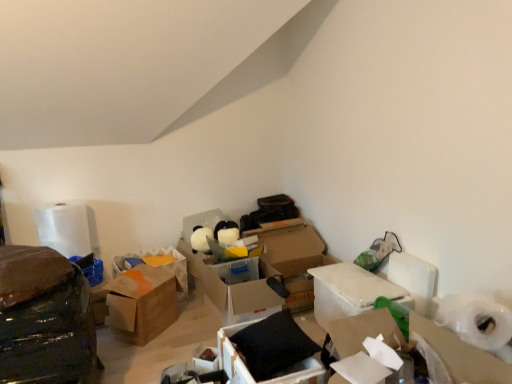
Question: From the image's perspective, is black matte pillow at center, which is the 2th box in right-to-left order, located beneath brown cardboard box at center, the second box from the left?

Choices:
 (A) no
 (B) yes

Answer: (B)

Question: Can you confirm if black matte pillow at center, the 4th box in the left-to-right sequence, is positioned to the left of brown cardboard box at center, placed as the 4th box when sorted from right to left?

Choices:
 (A) yes
 (B) no

Answer: (B)

Question: Considering the relative positions of black matte pillow at center, which is the 2th box in right-to-left order, and brown cardboard box at center, placed as the 4th box when sorted from right to left, in the image provided, is black matte pillow at center, which is the 2th box in right-to-left order, to the right of brown cardboard box at center, placed as the 4th box when sorted from right to left, from the viewer's perspective?

Choices:
 (A) yes
 (B) no

Answer: (A)

Question: Is black matte pillow at center, the 4th box in the left-to-right sequence, bigger than brown cardboard box at center, the second box from the left?

Choices:
 (A) no
 (B) yes

Answer: (A)

Question: From a real-world perspective, is black matte pillow at center, the 4th box in the left-to-right sequence, on top of brown cardboard box at center, placed as the 4th box when sorted from right to left?

Choices:
 (A) yes
 (B) no

Answer: (B)

Question: Considering the positions of matte cardboard box at center and brown cardboard box at center, the second box from the left, in the image, is matte cardboard box at center wider or thinner than brown cardboard box at center, the second box from the left,?

Choices:
 (A) wide
 (B) thin

Answer: (B)

Question: Based on their sizes in the image, would you say matte cardboard box at center is bigger or smaller than brown cardboard box at center, placed as the 4th box when sorted from right to left?

Choices:
 (A) small
 (B) big

Answer: (A)

Question: Considering the positions of matte cardboard box at center and brown cardboard box at center, placed as the 4th box when sorted from right to left, in the image, is matte cardboard box at center taller or shorter than brown cardboard box at center, placed as the 4th box when sorted from right to left,?

Choices:
 (A) tall
 (B) short

Answer: (B)

Question: From a real-world perspective, is matte cardboard box at center physically located above or below brown cardboard box at center, the second box from the left?

Choices:
 (A) below
 (B) above

Answer: (A)

Question: Considering the positions of white cardboard box at center-right, which appears as the fifth box when viewed from the left, and shiny black plastic bag at left in the image, is white cardboard box at center-right, which appears as the fifth box when viewed from the left, taller or shorter than shiny black plastic bag at left?

Choices:
 (A) tall
 (B) short

Answer: (B)

Question: Is white cardboard box at center-right, which is the 1th box from right to left, to the left or to the right of shiny black plastic bag at left in the image?

Choices:
 (A) left
 (B) right

Answer: (B)

Question: Based on their sizes in the image, would you say white cardboard box at center-right, which is the 1th box from right to left, is bigger or smaller than shiny black plastic bag at left?

Choices:
 (A) big
 (B) small

Answer: (B)

Question: Is white cardboard box at center-right, which is the 1th box from right to left, wider or thinner than shiny black plastic bag at left?

Choices:
 (A) wide
 (B) thin

Answer: (B)

Question: From the image's perspective, is shiny black plastic bag at left located above or below translucent plastic container at center, which is the third box in left-to-right order?

Choices:
 (A) above
 (B) below

Answer: (B)

Question: Looking at their shapes, would you say shiny black plastic bag at left is wider or thinner than translucent plastic container at center, which ranks as the third box in right-to-left order?

Choices:
 (A) wide
 (B) thin

Answer: (A)